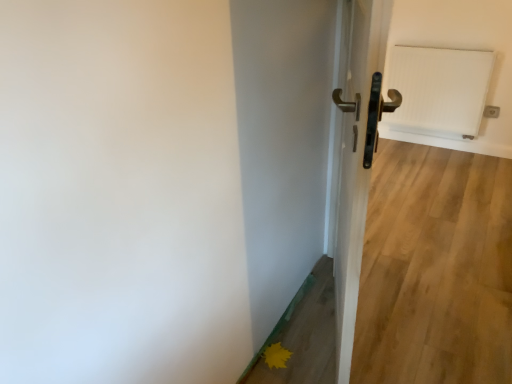
I want to click on spots to the right of yellow matte flower at lower right, so click(x=312, y=352).